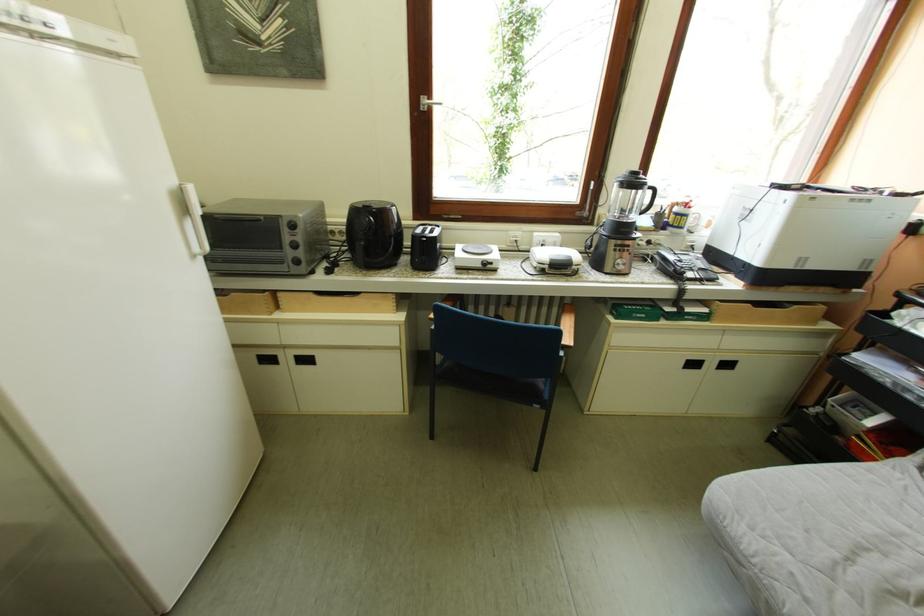
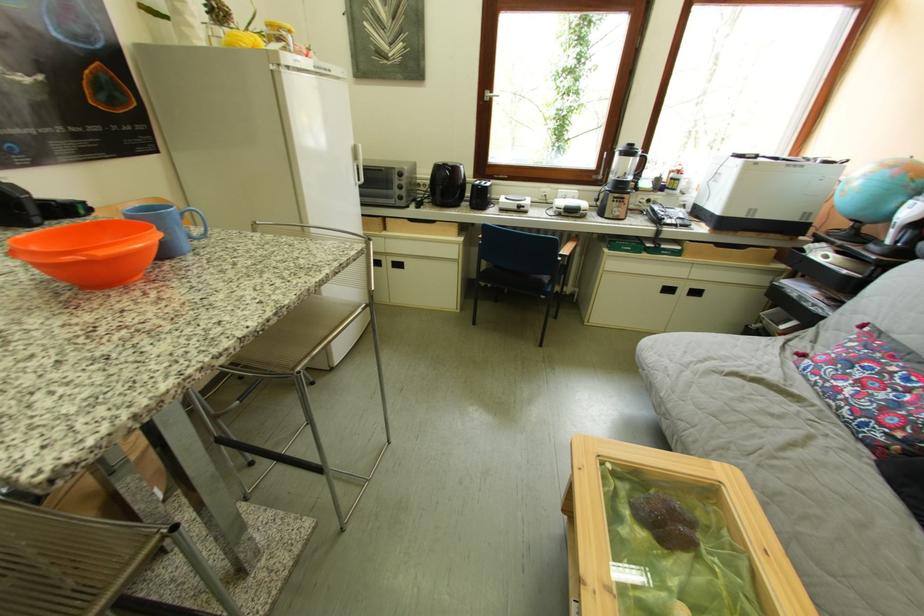
In the second image, find the point that corresponds to (x=433, y=100) in the first image.

(497, 94)